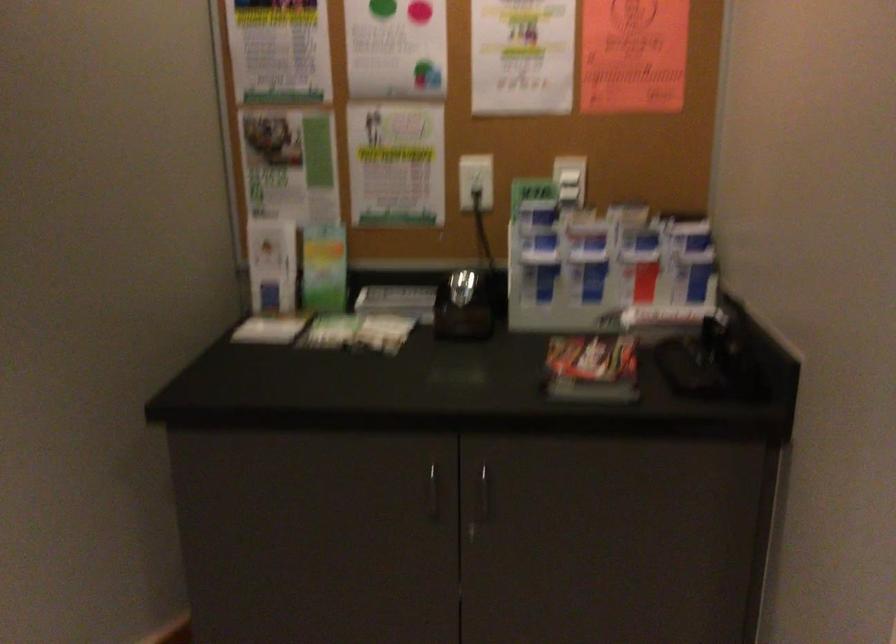
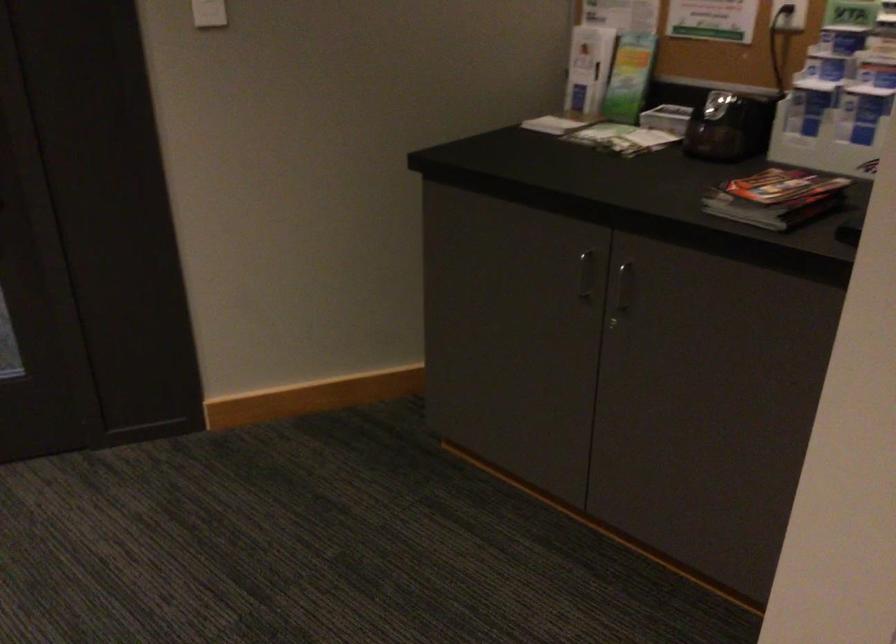
Locate, in the second image, the point that corresponds to [390,328] in the first image.

(647, 140)